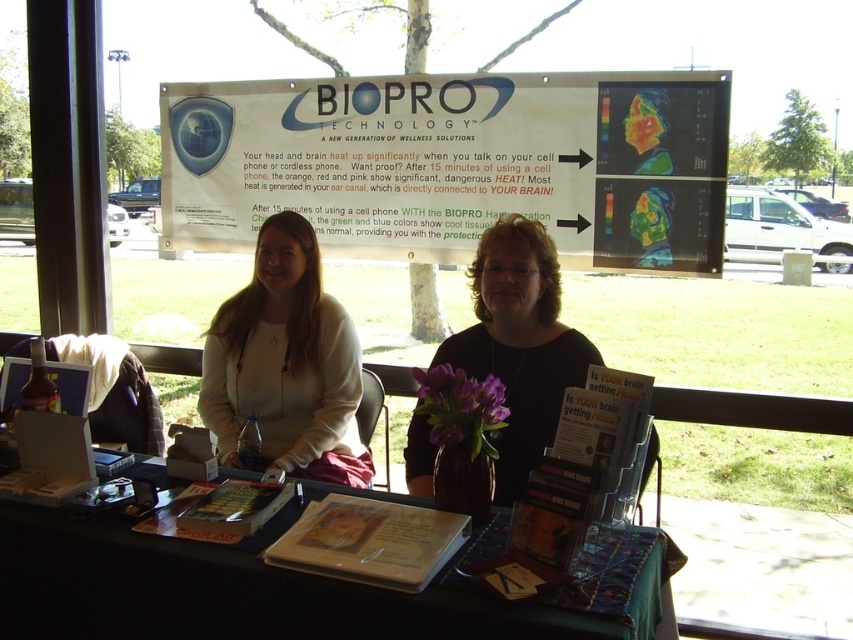
Between white paper at upper center and black matte shirt at center, which one is positioned higher?

white paper at upper center is higher up.

The height and width of the screenshot is (640, 853). I want to click on white paper at upper center, so pyautogui.click(x=456, y=163).

What do you see at coordinates (456, 163) in the screenshot?
I see `white paper at upper center` at bounding box center [456, 163].

Is point (651, 72) less distant than point (323, 625)?

That is False.

Is point (456, 125) behind point (550, 609)?

Yes, it is.

Locate an element on the screen. This screenshot has height=640, width=853. white paper at upper center is located at coordinates (456, 163).

Which is above, white paper at upper center or matte white sweater at center?

white paper at upper center

Does white paper at upper center appear on the right side of matte white sweater at center?

Indeed, white paper at upper center is positioned on the right side of matte white sweater at center.

What do you see at coordinates (456, 163) in the screenshot? The height and width of the screenshot is (640, 853). I see `white paper at upper center` at bounding box center [456, 163].

Locate an element on the screen. This screenshot has width=853, height=640. white paper at upper center is located at coordinates (456, 163).